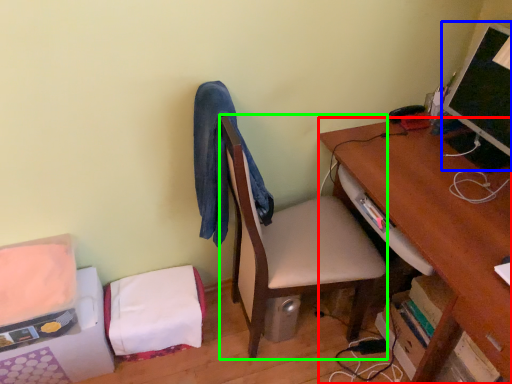
Question: Considering the real-world distances, which object is farthest from desk (highlighted by a red box)? computer monitor (highlighted by a blue box) or table (highlighted by a green box)?

Choices:
 (A) computer monitor
 (B) table

Answer: (B)